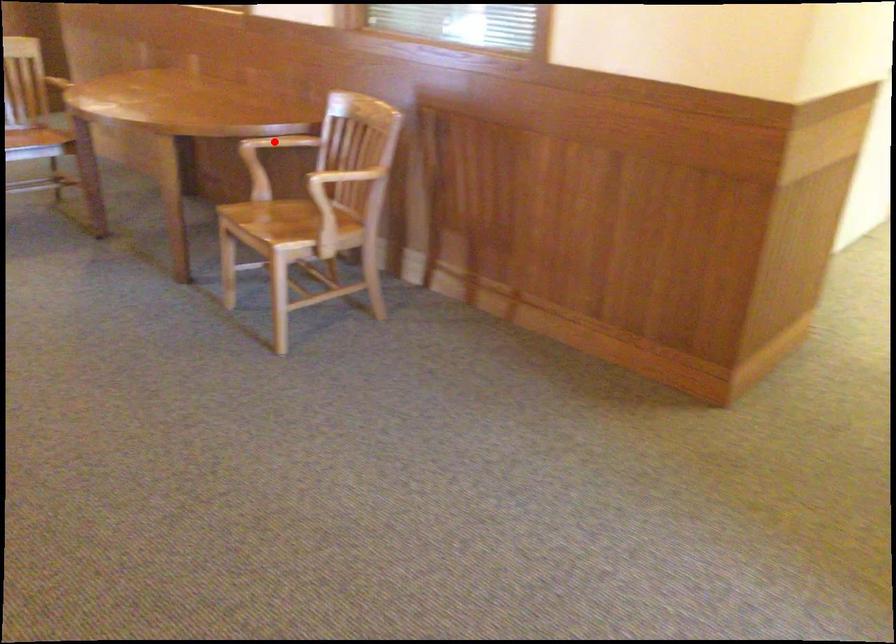
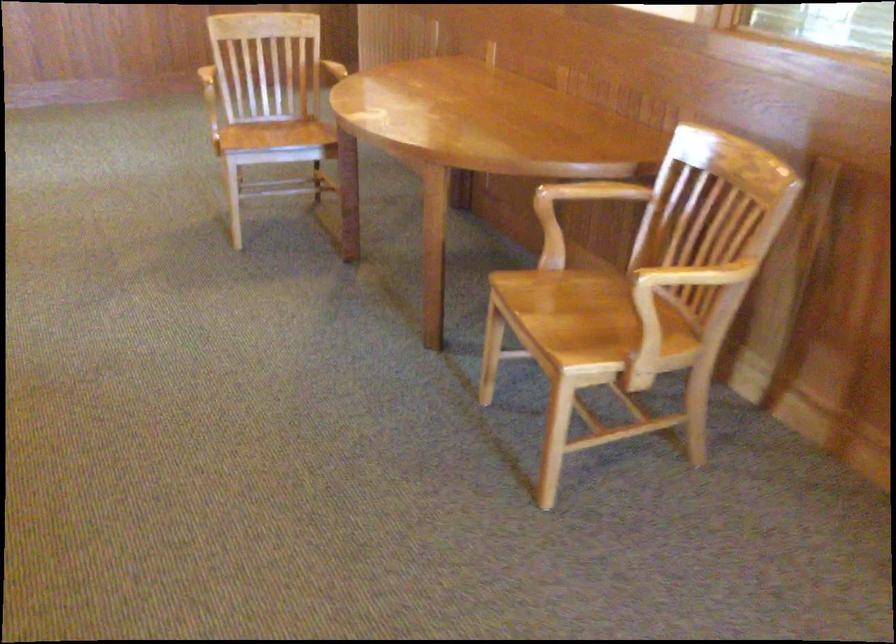
Question: I am providing you with two images of the same scene from different viewpoints. In image1, a red point is highlighted. Considering the same 3D point in image2, which of the following is correct?

Choices:
 (A) It is closer
 (B) It is farther

Answer: (A)